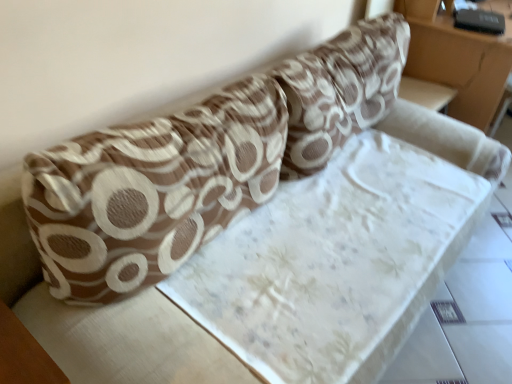
Question: Is white fabric table at lower left positioned behind brown textured pillow at upper center, which is the first throw pillow in left-to-right order?

Choices:
 (A) yes
 (B) no

Answer: (B)

Question: Does white fabric table at lower left appear on the left side of brown textured pillow at upper center, which is the first throw pillow in left-to-right order?

Choices:
 (A) no
 (B) yes

Answer: (B)

Question: Is white fabric table at lower left closer to camera compared to brown textured pillow at upper center, which is the first throw pillow in left-to-right order?

Choices:
 (A) yes
 (B) no

Answer: (A)

Question: From the image's perspective, is white fabric table at lower left located above brown textured pillow at upper center, which is the first throw pillow in left-to-right order?

Choices:
 (A) no
 (B) yes

Answer: (A)

Question: Does white fabric table at lower left have a lesser width compared to brown textured pillow at upper center, which is the first throw pillow in left-to-right order?

Choices:
 (A) no
 (B) yes

Answer: (B)

Question: From a real-world perspective, is brown textured pillow at upper center, which is the first throw pillow in left-to-right order, positioned above or below white fabric table at lower left?

Choices:
 (A) below
 (B) above

Answer: (B)

Question: Would you say brown textured pillow at upper center, which is the first throw pillow in left-to-right order, is inside or outside white fabric table at lower left?

Choices:
 (A) inside
 (B) outside

Answer: (B)

Question: Is brown textured pillow at upper center, the 2th throw pillow positioned from the right, in front of or behind white fabric table at lower left in the image?

Choices:
 (A) front
 (B) behind

Answer: (B)

Question: In terms of size, does brown textured pillow at upper center, the 2th throw pillow positioned from the right, appear bigger or smaller than white fabric table at lower left?

Choices:
 (A) small
 (B) big

Answer: (B)

Question: Does point (8, 360) appear closer or farther from the camera than point (117, 165)?

Choices:
 (A) farther
 (B) closer

Answer: (B)

Question: Is white fabric table at lower left to the left or to the right of brown textured pillow at upper center, which is the first throw pillow in left-to-right order, in the image?

Choices:
 (A) right
 (B) left

Answer: (B)

Question: From the image's perspective, relative to brown textured pillow at upper center, the 2th throw pillow positioned from the right, is white fabric table at lower left above or below?

Choices:
 (A) above
 (B) below

Answer: (B)

Question: Considering the positions of white fabric table at lower left and brown textured pillow at upper center, which is the first throw pillow in left-to-right order, in the image, is white fabric table at lower left bigger or smaller than brown textured pillow at upper center, which is the first throw pillow in left-to-right order,?

Choices:
 (A) small
 (B) big

Answer: (A)

Question: Is brown textured pillow at upper center, placed as the first throw pillow when sorted from right to left, bigger or smaller than white fabric table at lower left?

Choices:
 (A) small
 (B) big

Answer: (B)

Question: Is brown textured pillow at upper center, placed as the first throw pillow when sorted from right to left, spatially inside white fabric table at lower left, or outside of it?

Choices:
 (A) inside
 (B) outside

Answer: (B)